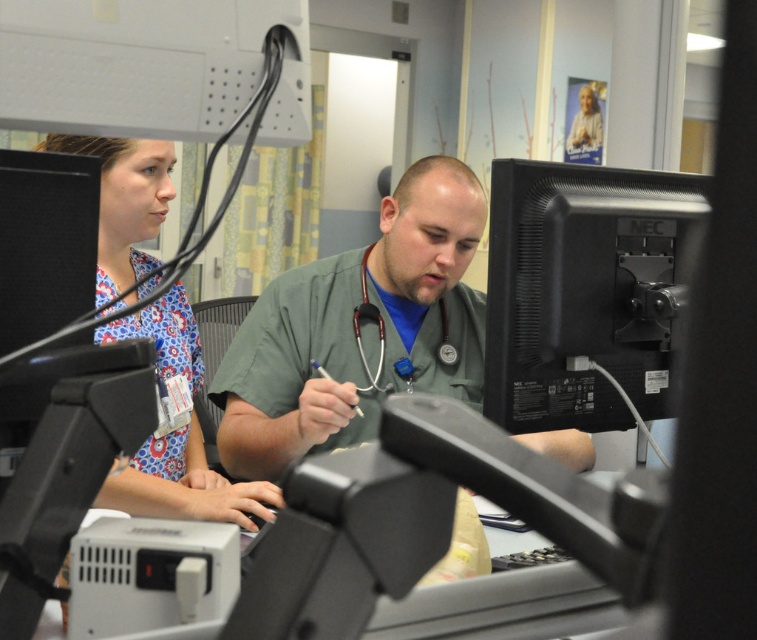
Question: Is green scrubs at center further to camera compared to black matte computer monitor at center right?

Choices:
 (A) no
 (B) yes

Answer: (B)

Question: Based on their relative distances, which object is nearer to the black matte computer monitor at center right?

Choices:
 (A) blue printed scrubs at left
 (B) green scrubs at center
 (C) wooden stethoscope at center

Answer: (B)

Question: Is green scrubs at center smaller than blue printed scrubs at left?

Choices:
 (A) yes
 (B) no

Answer: (B)

Question: Which object appears farthest from the camera in this image?

Choices:
 (A) black matte computer monitor at center right
 (B) green scrubs at center
 (C) blue printed scrubs at left

Answer: (B)

Question: Is black matte computer monitor at center right wider than blue printed scrubs at left?

Choices:
 (A) no
 (B) yes

Answer: (A)

Question: Which of the following is the farthest from the observer?

Choices:
 (A) blue printed scrubs at left
 (B) green scrubs at center
 (C) black matte computer monitor at center right

Answer: (B)